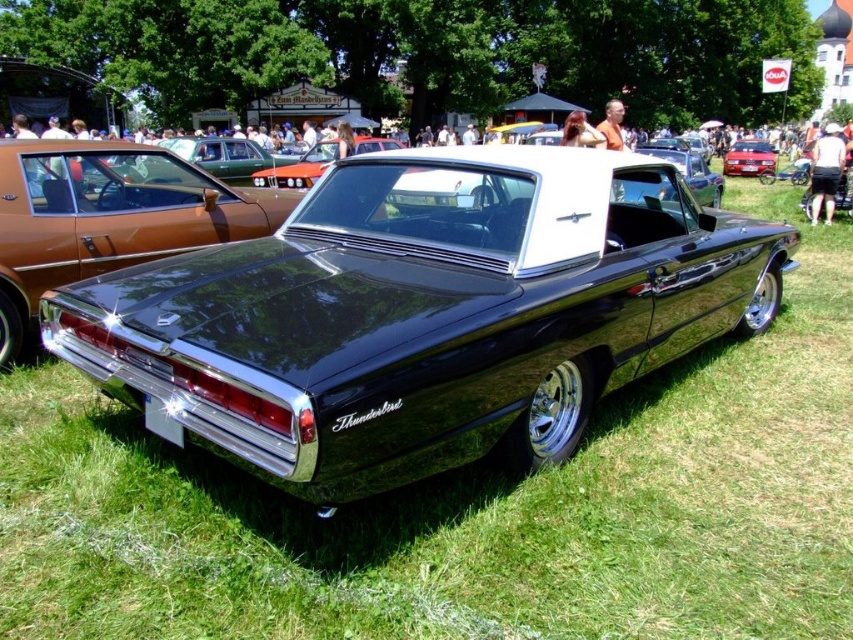
Question: Is shiny black thunderbird at center further to the viewer compared to metallic red car at center?

Choices:
 (A) no
 (B) yes

Answer: (A)

Question: Which object appears closest to the camera in this image?

Choices:
 (A) metallic red car at center
 (B) shiny black thunderbird at center

Answer: (B)

Question: Is shiny black thunderbird at center to the right of metallic red car at center from the viewer's perspective?

Choices:
 (A) yes
 (B) no

Answer: (B)

Question: Among these points, which one is farthest from the camera?

Choices:
 (A) (575, 323)
 (B) (753, 173)

Answer: (B)

Question: Can you confirm if shiny black thunderbird at center is wider than metallic red car at center?

Choices:
 (A) yes
 (B) no

Answer: (A)